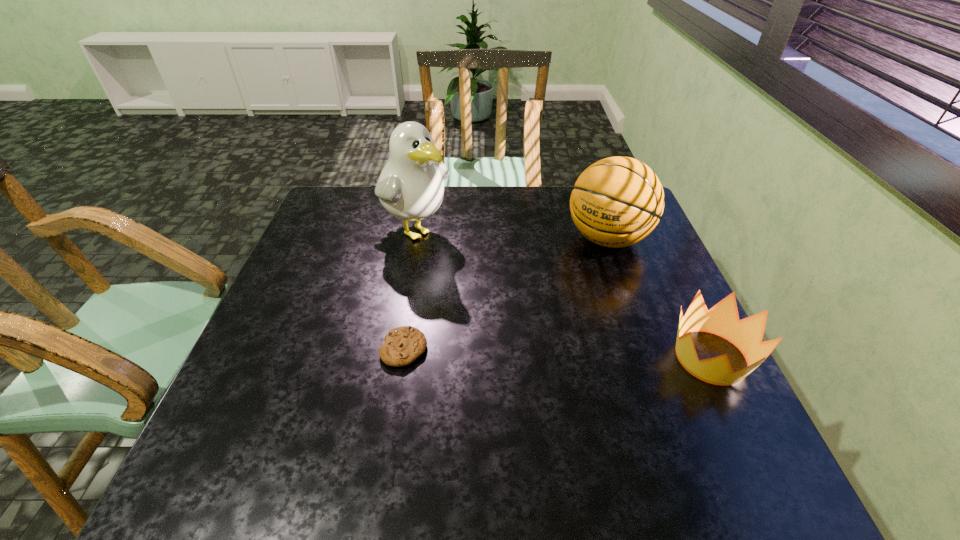
The width and height of the screenshot is (960, 540). Find the location of `the shortest object`. the shortest object is located at coordinates (403, 345).

At what (x,y) coordinates should I click in order to perform the action: click on the third tallest object. Please return your answer as a coordinate pair (x, y). The image size is (960, 540). Looking at the image, I should click on (746, 334).

The height and width of the screenshot is (540, 960). In order to click on basketball in this screenshot , I will do `click(616, 202)`.

Locate an element on the screen. The width and height of the screenshot is (960, 540). gull is located at coordinates (410, 187).

Where is `vacant region located 0.050m on the front of the cookie`? vacant region located 0.050m on the front of the cookie is located at coordinates (397, 389).

Find the location of a particular element. The image size is (960, 540). vacant region located 0.160m on the back of the crown is located at coordinates (674, 280).

Where is `vacant space located on the surface of the basketball near the brand logo`? The width and height of the screenshot is (960, 540). vacant space located on the surface of the basketball near the brand logo is located at coordinates (580, 272).

Locate an element on the screen. vacant area situated on the surface of the basketball near the brand logo is located at coordinates tap(520, 343).

The height and width of the screenshot is (540, 960). What are the coordinates of `free region located 0.180m on the surface of the basketball near the brand logo` in the screenshot? It's located at (559, 298).

The width and height of the screenshot is (960, 540). Identify the location of vacant space located on the beak of the gull. (470, 269).